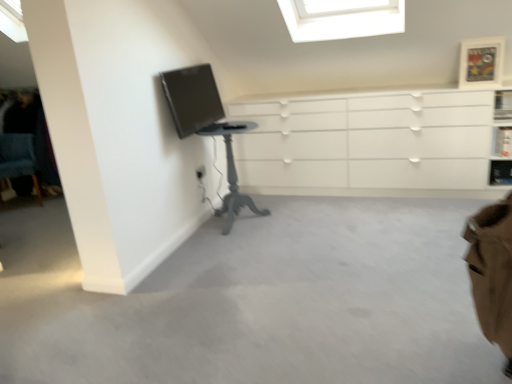
Locate an element on the screen. The image size is (512, 384). unoccupied area in front of blue fabric chair at lower left is located at coordinates (18, 212).